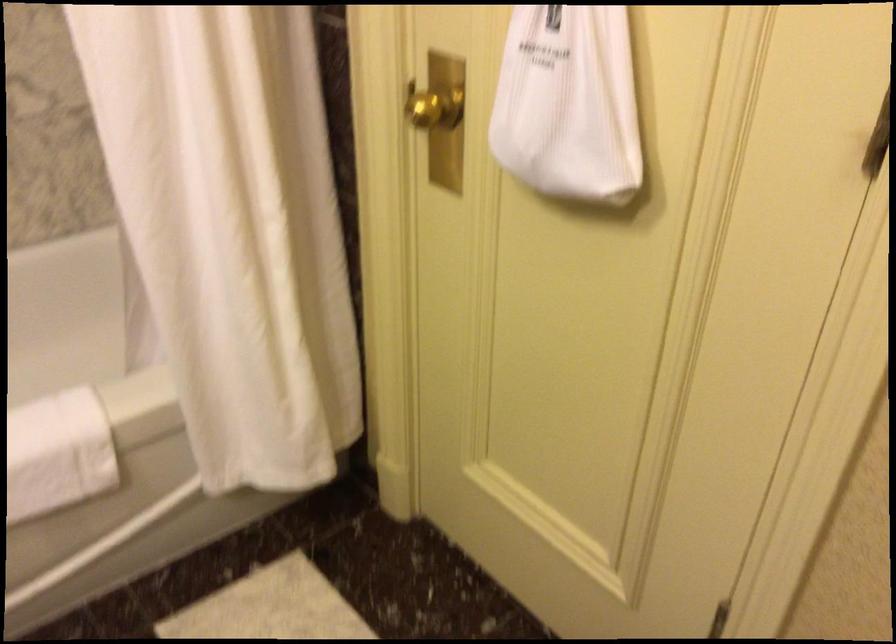
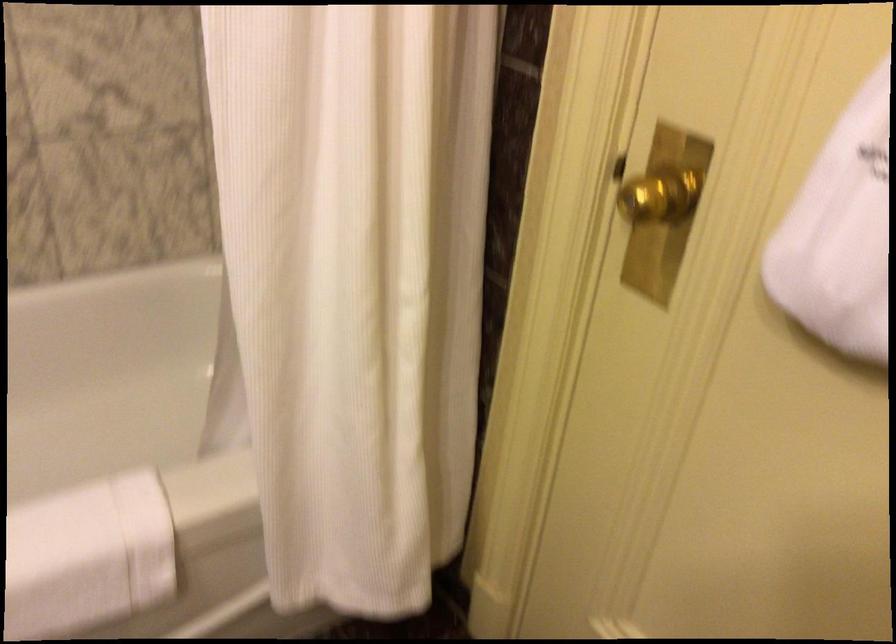
Question: Based on the continuous images, in which direction is the camera rotating? Reply with the corresponding letter.

Choices:
 (A) Left
 (B) Right
 (C) Up
 (D) Down

Answer: (A)